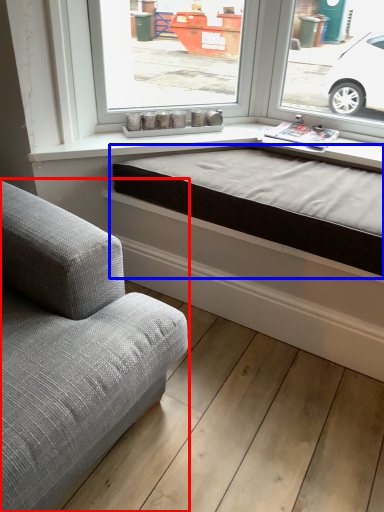
Question: Which object is further to the camera taking this photo, studio couch (highlighted by a red box) or bed frame (highlighted by a blue box)?

Choices:
 (A) studio couch
 (B) bed frame

Answer: (B)